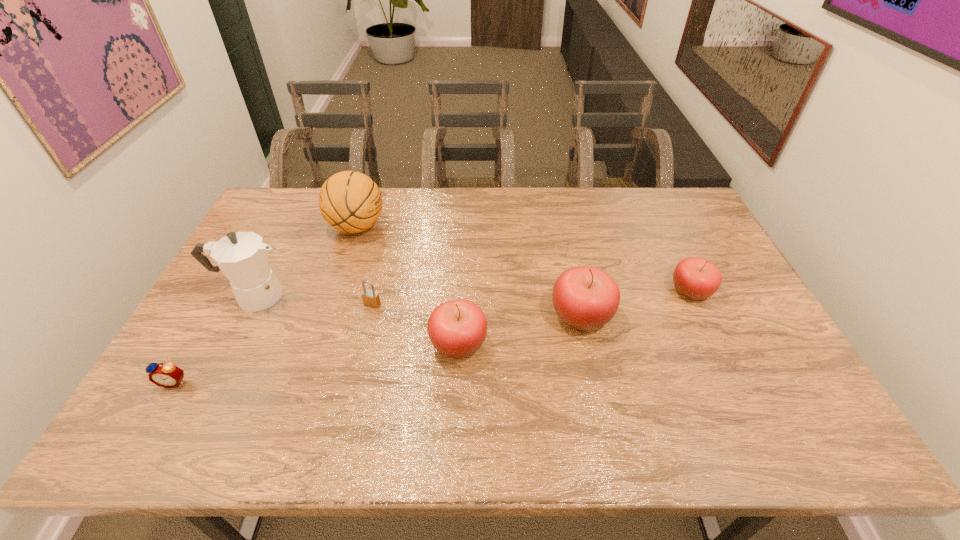
The image size is (960, 540). In order to click on free spot between the basketball and the second object from right to left in this screenshot , I will do `click(469, 272)`.

Where is `vacant region between the coffeepot and the alarm clock`? vacant region between the coffeepot and the alarm clock is located at coordinates (214, 339).

Image resolution: width=960 pixels, height=540 pixels. I want to click on free space between the third object from right to left and the coffeepot, so click(x=356, y=320).

Where is `free area in between the nearest object and the coffeepot`? free area in between the nearest object and the coffeepot is located at coordinates (214, 339).

Locate an element on the screen. empty space that is in between the leftmost apple and the padlock is located at coordinates (416, 324).

Select which object appears as the closest to the padlock. Please provide its 2D coordinates. Your answer should be formatted as a tuple, i.e. [(x, y)], where the tuple contains the x and y coordinates of a point satisfying the conditions above.

[(457, 328)]

Locate which object ranks fifth in proximity to the padlock. Please provide its 2D coordinates. Your answer should be formatted as a tuple, i.e. [(x, y)], where the tuple contains the x and y coordinates of a point satisfying the conditions above.

[(586, 298)]

Locate which apple ranks second in proximity to the coffeepot. Please provide its 2D coordinates. Your answer should be formatted as a tuple, i.e. [(x, y)], where the tuple contains the x and y coordinates of a point satisfying the conditions above.

[(586, 298)]

Where is `apple that is the second nearest to the second apple from right to left`? This screenshot has height=540, width=960. apple that is the second nearest to the second apple from right to left is located at coordinates (695, 278).

Locate an element on the screen. Image resolution: width=960 pixels, height=540 pixels. free space that satisfies the following two spatial constraints: 1. on the back side of the shortest apple; 2. on the left side of the padlock is located at coordinates (375, 291).